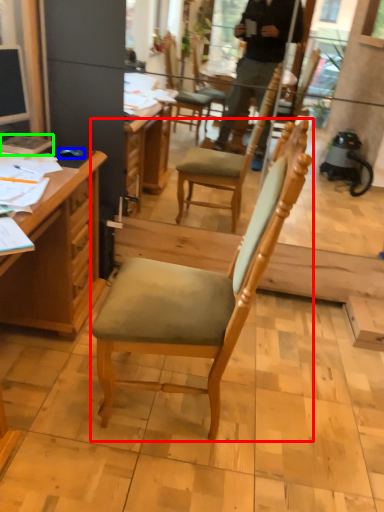
Question: Which is nearer to the chair (highlighted by a red box)? computer mouse (highlighted by a blue box) or book (highlighted by a green box).

Choices:
 (A) computer mouse
 (B) book

Answer: (A)